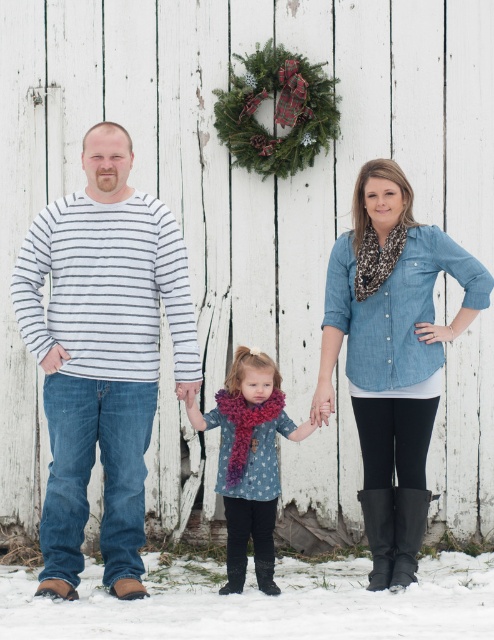
Question: Is striped cotton shirt at center wider than chambray shirt at center?

Choices:
 (A) no
 (B) yes

Answer: (B)

Question: Which point is closer to the camera taking this photo?

Choices:
 (A) (95, 307)
 (B) (458, 588)
 (C) (236, 456)

Answer: (A)

Question: Which object appears closest to the camera in this image?

Choices:
 (A) white fluffy snow at lower center
 (B) striped cotton shirt at center
 (C) knitted wool scarf at center

Answer: (A)

Question: Which object is farther from the camera taking this photo?

Choices:
 (A) knitted wool scarf at center
 (B) chambray shirt at center

Answer: (A)

Question: Can you confirm if knitted wool scarf at center is bigger than green textured wreath at upper center?

Choices:
 (A) no
 (B) yes

Answer: (B)

Question: Does striped cotton shirt at center have a larger size compared to green textured wreath at upper center?

Choices:
 (A) no
 (B) yes

Answer: (B)